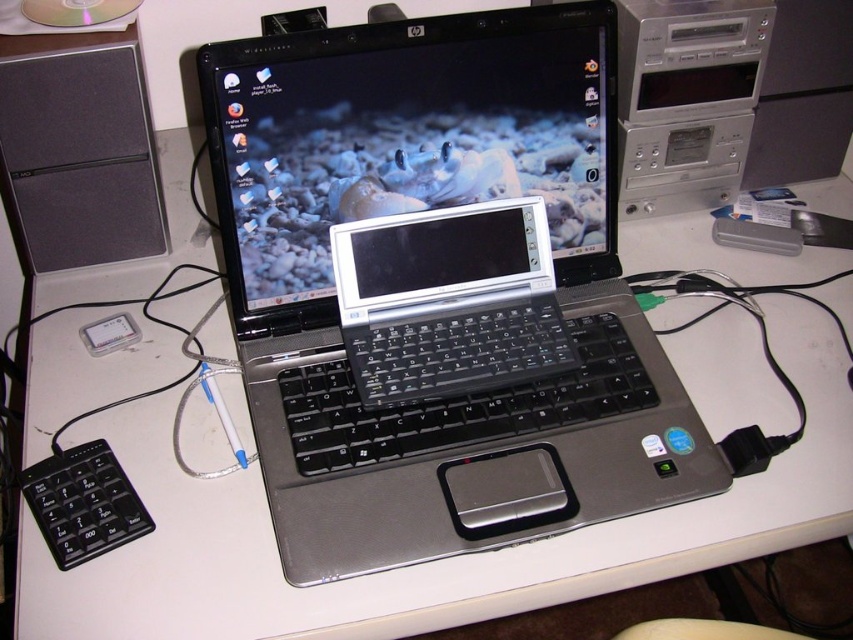
Question: Estimate the real-world distances between objects in this image. Which object is closer to the silver/black laptop at center?

Choices:
 (A) black matte speaker at upper left
 (B) silver/black plastic laptop at center
 (C) silver metallic handheld device at center

Answer: (B)

Question: Which object appears farthest from the camera in this image?

Choices:
 (A) silver metallic handheld device at center
 (B) silver/black plastic laptop at center
 (C) black matte speaker at upper left
 (D) silver/black laptop at center

Answer: (C)

Question: Where is silver/black laptop at center located in relation to silver metallic handheld device at center in the image?

Choices:
 (A) below
 (B) above

Answer: (B)

Question: Does silver/black laptop at center come in front of silver metallic handheld device at center?

Choices:
 (A) yes
 (B) no

Answer: (A)

Question: Is silver/black laptop at center thinner than silver metallic mouse at center?

Choices:
 (A) yes
 (B) no

Answer: (B)

Question: Which point appears farthest from the camera in this image?

Choices:
 (A) (467, 532)
 (B) (59, 225)

Answer: (B)